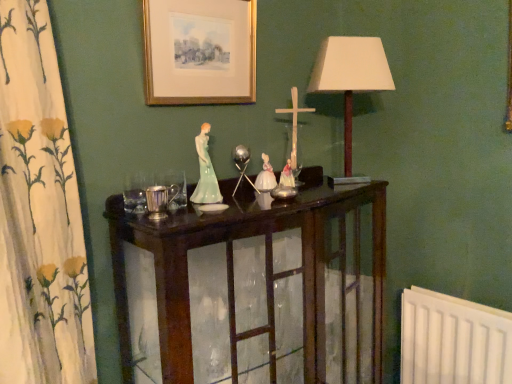
Question: Is gold-framed print at upper center thinner than white fabric lampshade at upper right?

Choices:
 (A) yes
 (B) no

Answer: (A)

Question: Can you confirm if gold-framed print at upper center is shorter than white fabric lampshade at upper right?

Choices:
 (A) no
 (B) yes

Answer: (B)

Question: Is gold-framed print at upper center outside of white fabric lampshade at upper right?

Choices:
 (A) no
 (B) yes

Answer: (B)

Question: Considering the relative positions of gold-framed print at upper center and white fabric lampshade at upper right in the image provided, is gold-framed print at upper center behind white fabric lampshade at upper right?

Choices:
 (A) yes
 (B) no

Answer: (B)

Question: From the image's perspective, is gold-framed print at upper center located beneath white fabric lampshade at upper right?

Choices:
 (A) no
 (B) yes

Answer: (A)

Question: Is gold-framed print at upper center bigger than white fabric lampshade at upper right?

Choices:
 (A) yes
 (B) no

Answer: (B)

Question: Considering the relative sizes of gold-framed print at upper center and silver metallic candle holder at center in the image provided, is gold-framed print at upper center smaller than silver metallic candle holder at center?

Choices:
 (A) no
 (B) yes

Answer: (A)

Question: Considering the relative sizes of gold-framed print at upper center and silver metallic candle holder at center in the image provided, is gold-framed print at upper center bigger than silver metallic candle holder at center?

Choices:
 (A) no
 (B) yes

Answer: (B)

Question: From the image's perspective, is gold-framed print at upper center located beneath silver metallic candle holder at center?

Choices:
 (A) yes
 (B) no

Answer: (B)

Question: Is gold-framed print at upper center facing towards silver metallic candle holder at center?

Choices:
 (A) no
 (B) yes

Answer: (A)

Question: Is silver metallic candle holder at center surrounded by gold-framed print at upper center?

Choices:
 (A) no
 (B) yes

Answer: (A)

Question: From the image's perspective, is gold-framed print at upper center on silver metallic candle holder at center?

Choices:
 (A) no
 (B) yes

Answer: (B)

Question: From a real-world perspective, is dark wood cabinet at center on white fabric lampshade at upper right?

Choices:
 (A) no
 (B) yes

Answer: (A)